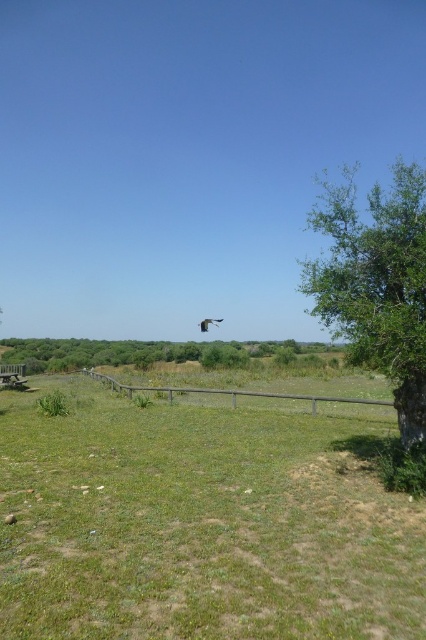
Between green grass at lower left and wooden fence at center, which one has less height?

With less height is green grass at lower left.

Is green grass at lower left smaller than wooden fence at center?

Yes.

Is point (354, 609) closer to viewer compared to point (198, 392)?

Yes, it is.

What are the coordinates of `green grass at lower left` in the screenshot? It's located at (201, 522).

Is green leafy tree at right further to camera compared to wooden fence at center?

No, it is in front of wooden fence at center.

Which is more to the right, green leafy tree at right or wooden fence at center?

green leafy tree at right

Locate an element on the screen. green leafy tree at right is located at coordinates [x=377, y=284].

This screenshot has width=426, height=640. What are the coordinates of `green leafy tree at right` in the screenshot? It's located at (377, 284).

Who is more distant from viewer, (233, 474) or (131, 340)?

The point (131, 340) is behind.

Which of these two, green grass at lower left or green leafy tree at center, stands taller?

With more height is green leafy tree at center.

Find the location of a particular element. Image resolution: width=426 pixels, height=640 pixels. green grass at lower left is located at coordinates (201, 522).

This screenshot has height=640, width=426. In order to click on green grass at lower left in this screenshot , I will do `click(201, 522)`.